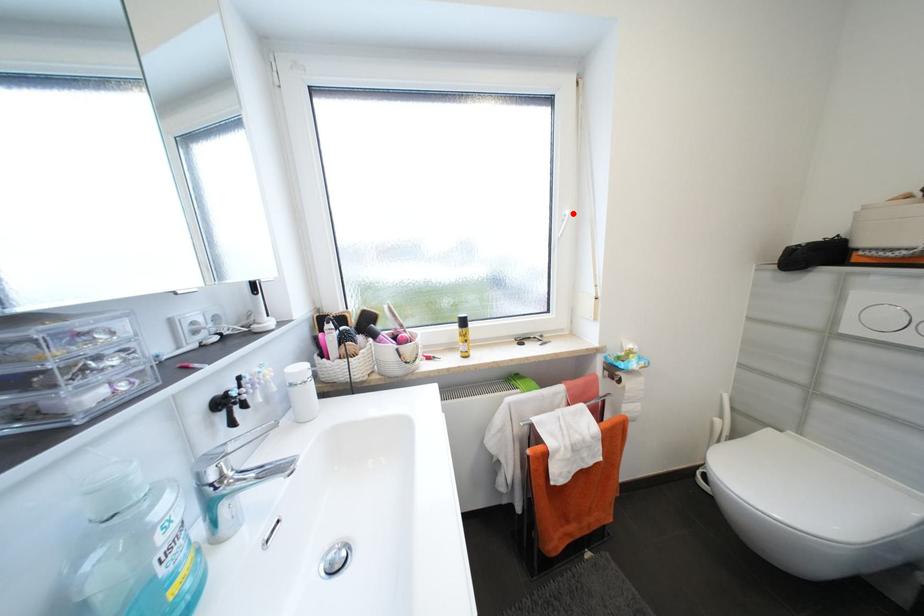
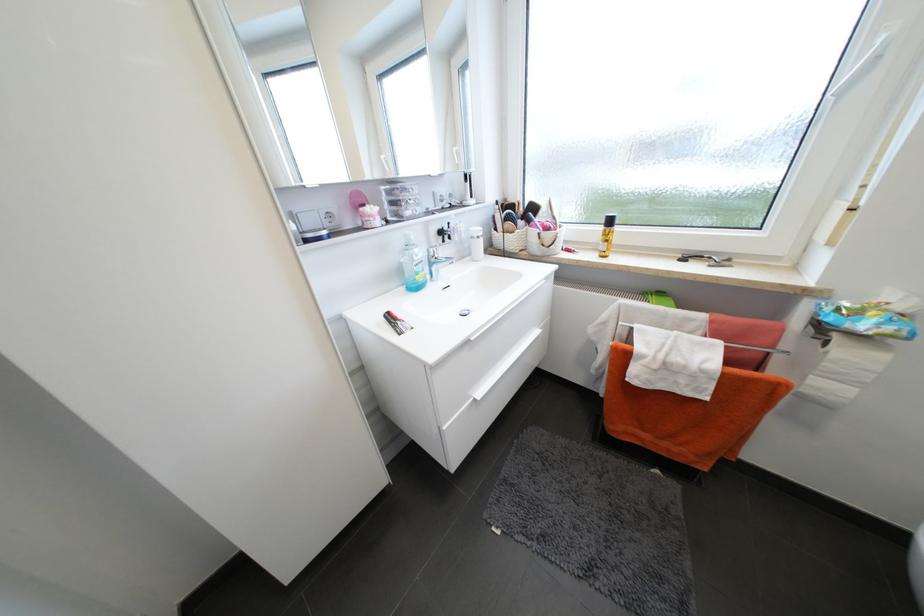
The point at the highlighted location is marked in the first image. Where is the corresponding point in the second image?

(888, 41)